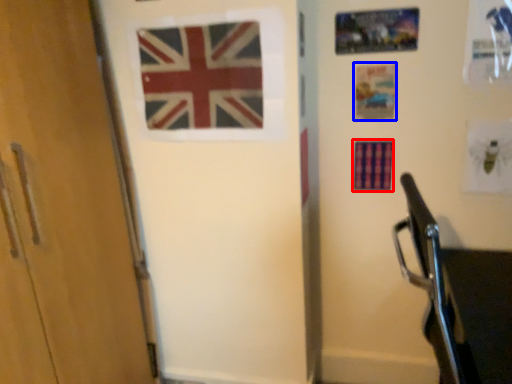
Question: Which point is closer to the camera, flag (highlighted by a red box) or postcard (highlighted by a blue box)?

Choices:
 (A) flag
 (B) postcard

Answer: (B)